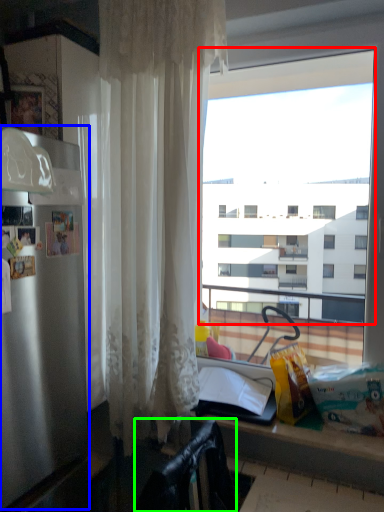
Question: Which is farther away from window (highlighted by a red box)? appliance (highlighted by a blue box) or chair (highlighted by a green box)?

Choices:
 (A) appliance
 (B) chair

Answer: (B)